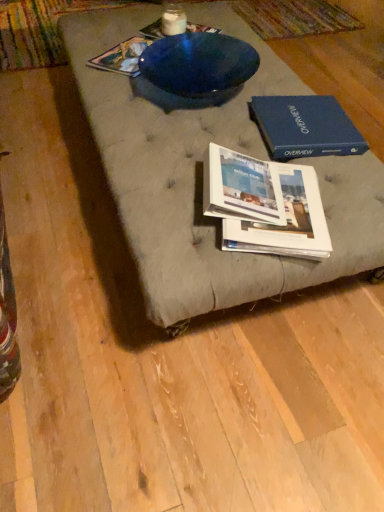
Question: From a real-world perspective, relative to white glossy book at center, acting as the second book starting from the front, is white glossy book at center, which is the fourth book from back to front, vertically above or below?

Choices:
 (A) below
 (B) above

Answer: (B)

Question: Would you say white glossy book at center, arranged as the first book when viewed from the front, is inside or outside white glossy book at center, which ranks as the first book in bottom-to-top order?

Choices:
 (A) inside
 (B) outside

Answer: (B)

Question: Which of these objects is positioned closest to the blue glossy bowl at upper center, which appears as the 3th book when viewed from the front?

Choices:
 (A) blue hardcover book at upper right
 (B) white glossy book at center, which is the fourth book from back to front
 (C) white glossy book at center, which ranks as the first book in bottom-to-top order
 (D) textured gray cushion at center
 (E) blue glossy bowl at upper center, marked as the fourth book in a bottom-to-top arrangement

Answer: (E)

Question: Which of these objects is positioned farthest from the textured gray cushion at center?

Choices:
 (A) white glossy book at center, which is the fourth book from back to front
 (B) blue hardcover book at upper right
 (C) blue glossy bowl at upper center, placed as the second book when sorted from back to front
 (D) blue glossy bowl at upper center, marked as the fourth book in a bottom-to-top arrangement
 (E) white glossy book at center, which is counted as the 4th book, starting from the top

Answer: (D)